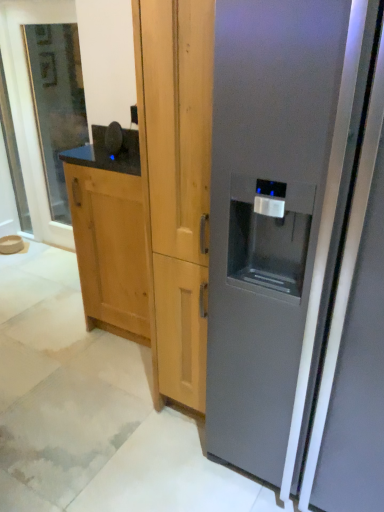
Question: From their relative heights in the image, would you say satin gray refrigerator at right is taller or shorter than clear glass door at left?

Choices:
 (A) tall
 (B) short

Answer: (B)

Question: Is point (311, 211) positioned closer to the camera than point (64, 201)?

Choices:
 (A) closer
 (B) farther

Answer: (A)

Question: Based on their relative distances, which object is nearer to the clear glass door at left?

Choices:
 (A) natural wood cabinet at left
 (B) satin gray refrigerator at right

Answer: (A)

Question: Which of these objects is positioned closest to the clear glass door at left?

Choices:
 (A) satin gray refrigerator at right
 (B) natural wood cabinet at left

Answer: (B)